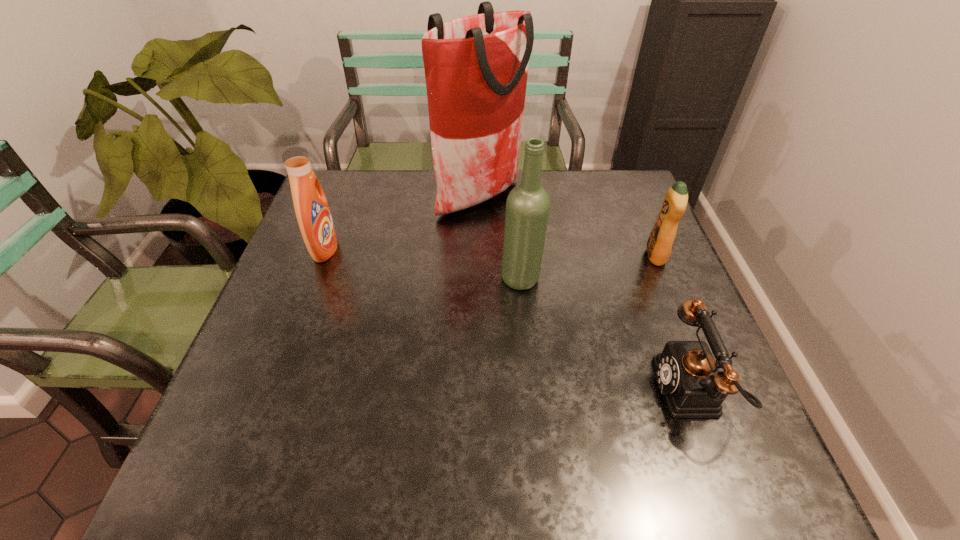
Where is `the farthest object`? Image resolution: width=960 pixels, height=540 pixels. the farthest object is located at coordinates (476, 67).

At what (x,y) coordinates should I click in order to perform the action: click on grocery bag. Please return your answer as a coordinate pair (x, y). The image size is (960, 540). Looking at the image, I should click on (476, 67).

Find the location of a particular element. Image resolution: width=960 pixels, height=540 pixels. the second tallest object is located at coordinates (528, 204).

Locate an element on the screen. the left detergent is located at coordinates (312, 211).

The height and width of the screenshot is (540, 960). Find the location of `the taller detergent`. the taller detergent is located at coordinates (312, 211).

This screenshot has width=960, height=540. What are the coordinates of `the right detergent` in the screenshot? It's located at (659, 245).

Locate an element on the screen. The image size is (960, 540). the shorter detergent is located at coordinates (659, 245).

Image resolution: width=960 pixels, height=540 pixels. I want to click on telephone, so click(x=689, y=377).

You are a GUI agent. You are given a task and a screenshot of the screen. Output one action in this format:
    pyautogui.click(x=<x>, y=<y>)
    Task: Click on the nearest object
    The height and width of the screenshot is (540, 960).
    Given the screenshot: What is the action you would take?
    pyautogui.click(x=689, y=377)

You are a GUI agent. You are given a task and a screenshot of the screen. Output one action in this format:
    pyautogui.click(x=<x>, y=<y>)
    Task: Click on the blank space located on the left of the farthest object
    
    Given the screenshot: What is the action you would take?
    pyautogui.click(x=353, y=197)